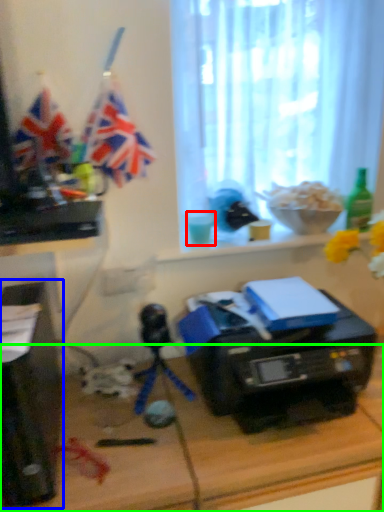
Question: Which object is positioned closest to coffee cup (highlighted by a red box)? Select from desktop computer (highlighted by a blue box) and desk (highlighted by a green box).

Choices:
 (A) desktop computer
 (B) desk

Answer: (B)